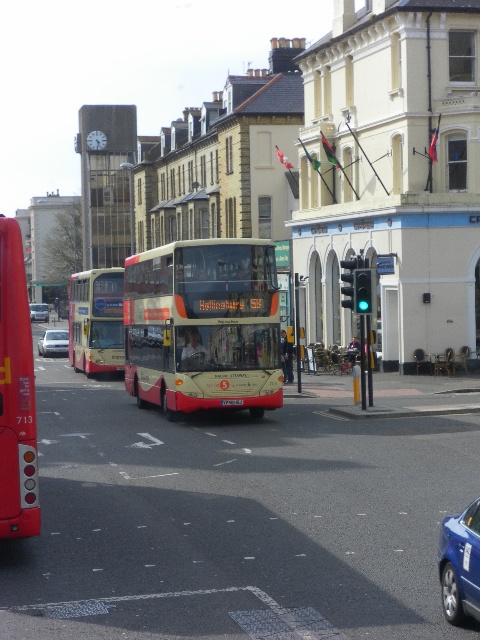
What do you see at coordinates (38, 312) in the screenshot? I see `silver metallic car at center` at bounding box center [38, 312].

Is point (36, 310) positioned behind point (238, 404)?

That is True.

This screenshot has height=640, width=480. Identify the location of silver metallic car at center. (38, 312).

Is matte red bus at left to the right of silver metallic car at center from the viewer's perspective?

Yes, matte red bus at left is to the right of silver metallic car at center.

Locate an element on the screen. matte red bus at left is located at coordinates (15, 394).

The image size is (480, 640). What are the coordinates of `matte red bus at left` in the screenshot? It's located at (15, 394).

At what (x,y) coordinates should I click in order to perform the action: click on matte red bus at left. Please return your answer as a coordinate pair (x, y). This screenshot has height=640, width=480. Looking at the image, I should click on (15, 394).

Which is below, matte red bus at left or metallic blue sedan at lower right?

metallic blue sedan at lower right is below.

Can you confirm if matte red bus at left is thinner than metallic blue sedan at lower right?

No, matte red bus at left is not thinner than metallic blue sedan at lower right.

Locate an element on the screen. Image resolution: width=480 pixels, height=640 pixels. matte red bus at left is located at coordinates (15, 394).

Find the location of a particular element. This screenshot has height=640, width=480. matte red bus at left is located at coordinates (15, 394).